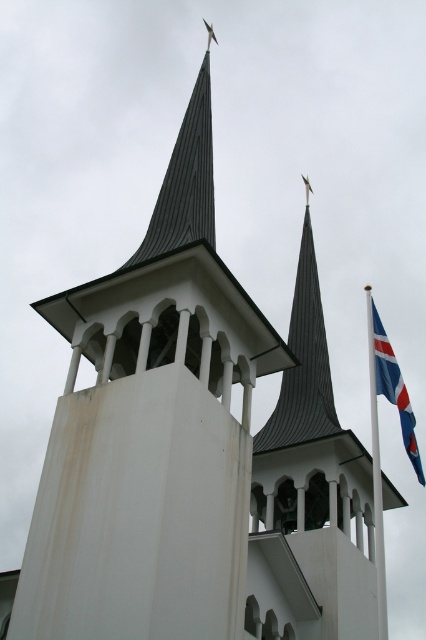
Which is below, white metallic flag pole at right or blue and white fabric flag at right?

white metallic flag pole at right is lower down.

Between white metallic flag pole at right and blue and white fabric flag at right, which one appears on the right side from the viewer's perspective?

white metallic flag pole at right

Who is more forward, (379, 340) or (382, 348)?

Point (382, 348) is more forward.

You are a GUI agent. You are given a task and a screenshot of the screen. Output one action in this format:
    pyautogui.click(x=<x>, y=<y>)
    Task: Click on the white metallic flag pole at right
    
    Given the screenshot: What is the action you would take?
    pyautogui.click(x=377, y=474)